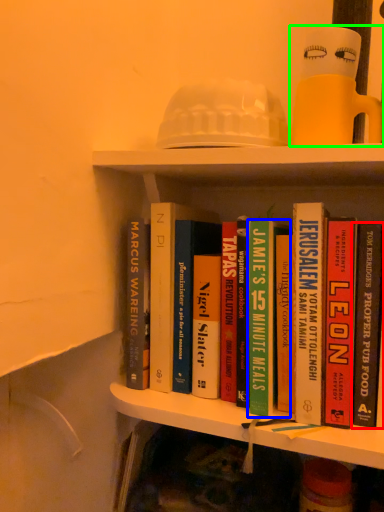
Question: Which object is the closest to the book (highlighted by a red box)? Choose among these: book (highlighted by a blue box) or toy (highlighted by a green box).

Choices:
 (A) book
 (B) toy

Answer: (A)